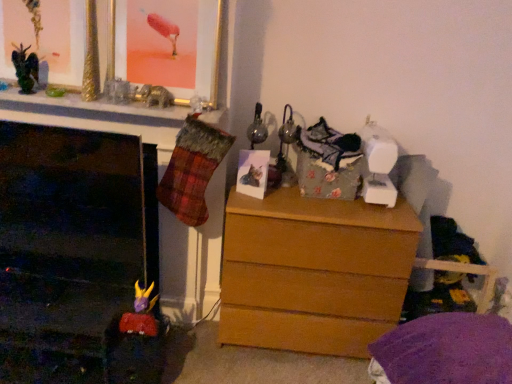
Question: Considering the relative sizes of matte paper photo at center, the 1th picture frame in the right-to-left sequence, and metallic black dragon at upper left in the image provided, is matte paper photo at center, the 1th picture frame in the right-to-left sequence, smaller than metallic black dragon at upper left?

Choices:
 (A) no
 (B) yes

Answer: (A)

Question: Is metallic black dragon at upper left inside matte paper photo at center, which is the 2th picture frame in left-to-right order?

Choices:
 (A) yes
 (B) no

Answer: (B)

Question: Does matte paper photo at center, the 2th picture frame viewed from the top, lie in front of metallic black dragon at upper left?

Choices:
 (A) no
 (B) yes

Answer: (A)

Question: Is matte paper photo at center, the 2th picture frame viewed from the top, outside metallic black dragon at upper left?

Choices:
 (A) yes
 (B) no

Answer: (A)

Question: From a real-world perspective, is matte paper photo at center, the 1th picture frame in the right-to-left sequence, on metallic black dragon at upper left?

Choices:
 (A) yes
 (B) no

Answer: (B)

Question: Relative to light brown wood chest of drawers at center, is metallic black dragon at upper left in front or behind?

Choices:
 (A) behind
 (B) front

Answer: (B)

Question: Does point (22, 48) appear closer or farther from the camera than point (308, 291)?

Choices:
 (A) farther
 (B) closer

Answer: (B)

Question: Considering the positions of metallic black dragon at upper left and light brown wood chest of drawers at center in the image, is metallic black dragon at upper left bigger or smaller than light brown wood chest of drawers at center?

Choices:
 (A) small
 (B) big

Answer: (A)

Question: From the image's perspective, relative to light brown wood chest of drawers at center, is metallic black dragon at upper left above or below?

Choices:
 (A) above
 (B) below

Answer: (A)

Question: Is metallic black dragon at upper left in front of or behind matte paper photo at center, the 1th picture frame in the right-to-left sequence, in the image?

Choices:
 (A) behind
 (B) front

Answer: (B)

Question: In terms of height, does metallic black dragon at upper left look taller or shorter compared to matte paper photo at center, the 1th picture frame in the right-to-left sequence?

Choices:
 (A) short
 (B) tall

Answer: (A)

Question: Is metallic black dragon at upper left to the left or to the right of matte paper photo at center, the 1th picture frame in the right-to-left sequence, in the image?

Choices:
 (A) left
 (B) right

Answer: (A)

Question: From a real-world perspective, is metallic black dragon at upper left physically located above or below matte paper photo at center, which is the 1th picture frame from bottom to top?

Choices:
 (A) below
 (B) above

Answer: (B)

Question: From a real-world perspective, is gold metallic picture frame at upper center, the 2th picture frame viewed from the right, physically located above or below matte paper photo at center, which is the 2th picture frame in left-to-right order?

Choices:
 (A) below
 (B) above

Answer: (B)

Question: Considering their positions, is gold metallic picture frame at upper center, arranged as the first picture frame when viewed from the left, located in front of or behind matte paper photo at center, the 2th picture frame viewed from the top?

Choices:
 (A) front
 (B) behind

Answer: (A)